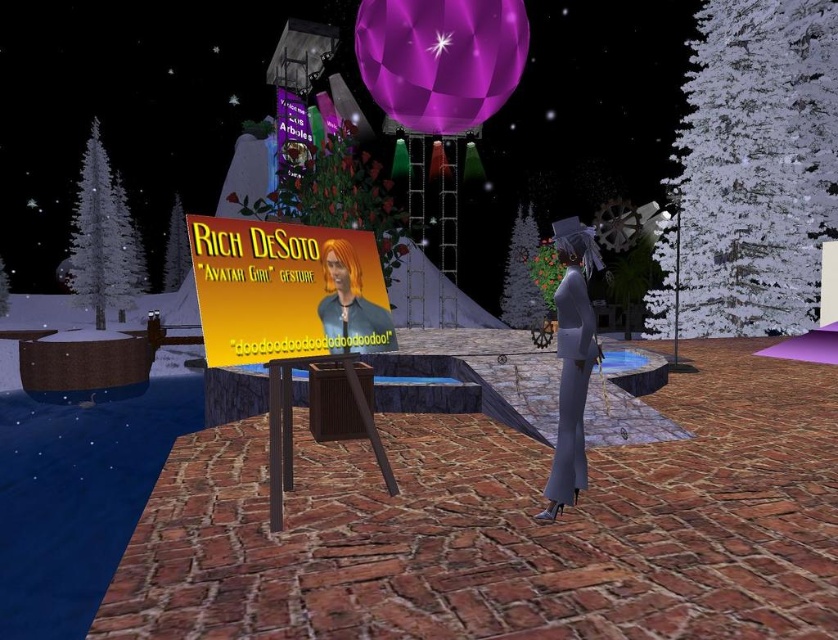
Looking at this image, you are navigating a nighttime virtual environment with a cobblestone path. You see a signpost with a yellow background and a character wearing a blue outfit. There is also a matte white suit at right. Which object is closer to the center of the scene?

The matte white suit at right is located at point (572, 362), which is closer to the center of the scene compared to the other objects mentioned.

You are navigating a virtual environment at night. You see two points marked on the ground, one at coordinates point (x=575, y=496) and the other at point (x=344, y=300). Which point is closer to you if you are facing the direction the signpost is pointing?

Point (x=575, y=496) is in front of point (x=344, y=300), so it is closer to you when facing the signpost direction.